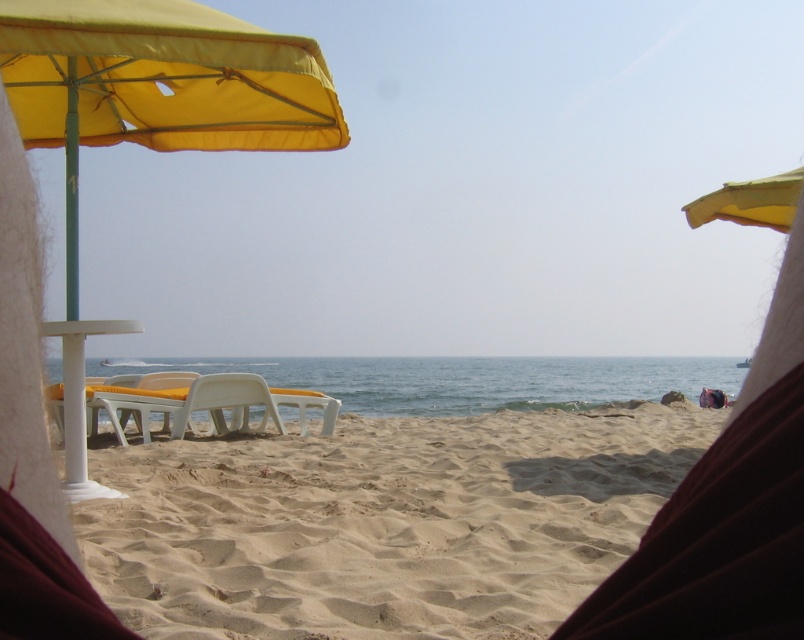
Question: Which of these objects is positioned farthest from the yellow matte umbrella at upper right?

Choices:
 (A) yellow fabric umbrella at left
 (B) yellow fabric umbrella at upper left
 (C) sandy beach at center

Answer: (C)

Question: Among these objects, which one is farthest from the camera?

Choices:
 (A) sandy beach at center
 (B) yellow matte umbrella at upper right
 (C) yellow fabric umbrella at left

Answer: (B)

Question: Which object is the farthest from the yellow matte umbrella at upper right?

Choices:
 (A) yellow fabric umbrella at left
 (B) white plastic beach chair at center

Answer: (B)

Question: Does yellow fabric umbrella at left appear under yellow matte umbrella at upper right?

Choices:
 (A) no
 (B) yes

Answer: (B)

Question: Is sandy beach at center in front of yellow fabric umbrella at left?

Choices:
 (A) no
 (B) yes

Answer: (B)

Question: Is sandy beach at center behind yellow fabric umbrella at upper left?

Choices:
 (A) yes
 (B) no

Answer: (B)